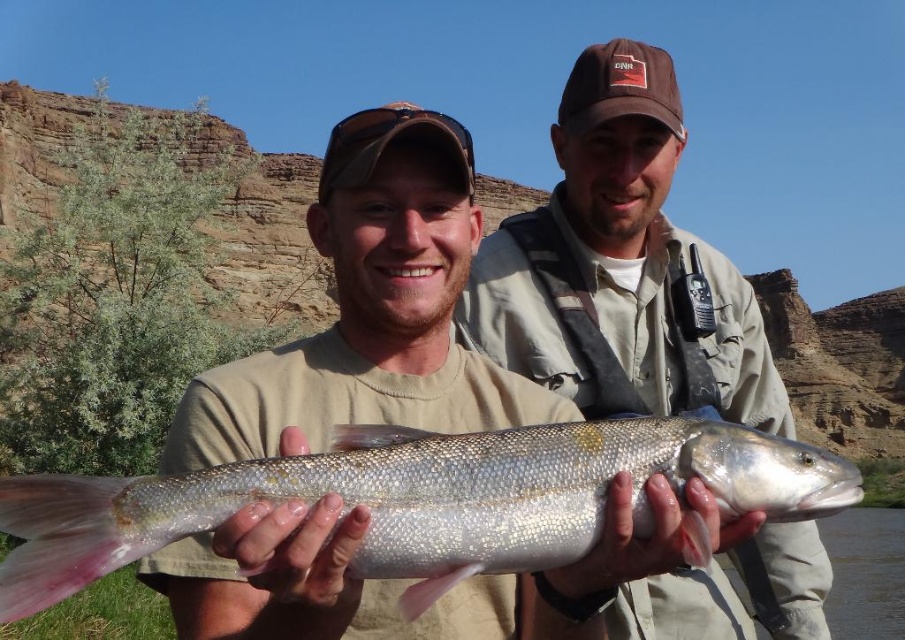
You are a wildlife researcher observing two fish caught in a lake. You notice the shiny metallic fish at center and the shiny silver fish at center. Which fish is bigger?

The shiny metallic fish at center is larger in size compared to the shiny silver fish at center.

You are standing at the origin point in the image. The coordinates given are in a normalized system where 0 is the bottom left corner and 1 is the top right corner. Can you determine the direction of the matte beige shirt at center from your current position?

The matte beige shirt at center is located at coordinates point (370, 308). Since the coordinate system starts at the bottom left corner as 0, the x value of 0.484 places it slightly to the right of center horizontally, and the y value of 0.410 places it below center vertically. Therefore, the matte beige shirt at center is positioned to the right and slightly below the center point from your current position at the origin.